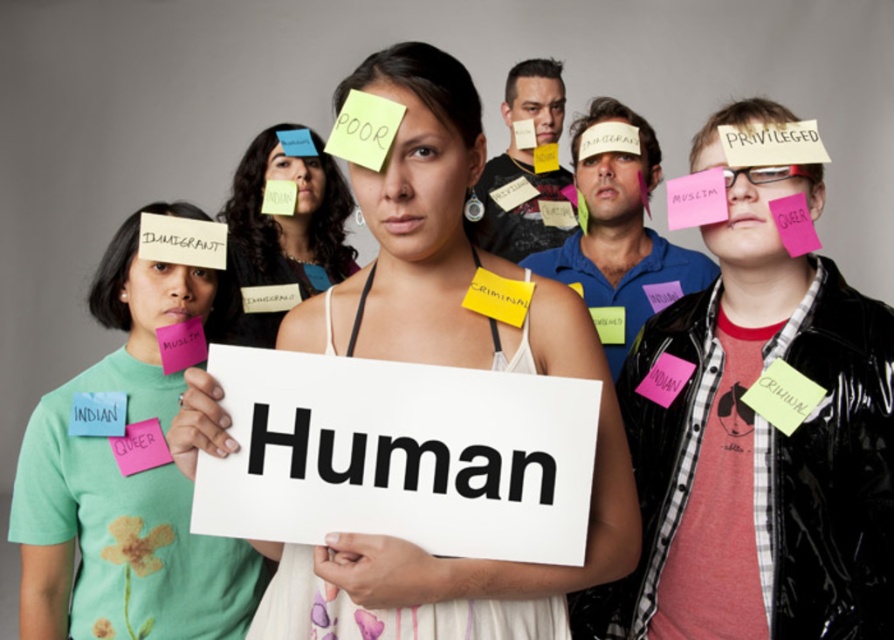
Question: Can you confirm if white fabric sign at center is positioned below matte paper sign at center?

Choices:
 (A) yes
 (B) no

Answer: (A)

Question: Estimate the real-world distances between objects in this image. Which object is closer to the matte paper sign at center?

Choices:
 (A) white fabric sign at center
 (B) green t-shirt at left

Answer: (B)

Question: Which object is the closest to the green t-shirt at left?

Choices:
 (A) white fabric sign at center
 (B) matte paper sign at center

Answer: (B)

Question: Which object is the farthest from the matte paper sign at center?

Choices:
 (A) green t-shirt at left
 (B) white fabric sign at center

Answer: (B)

Question: Does green t-shirt at left have a smaller size compared to matte paper sign at center?

Choices:
 (A) no
 (B) yes

Answer: (B)

Question: Can you confirm if white fabric sign at center is smaller than green t-shirt at left?

Choices:
 (A) yes
 (B) no

Answer: (B)